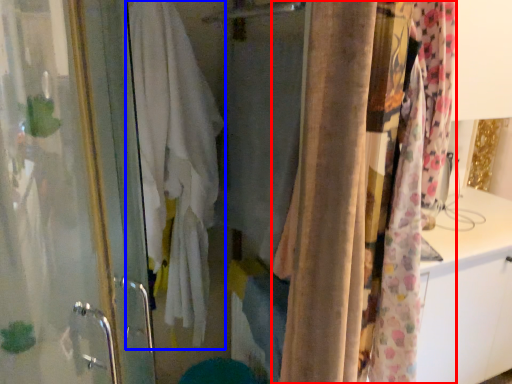
Question: Which object is closer to the camera taking this photo, curtain (highlighted by a red box) or bath towel (highlighted by a blue box)?

Choices:
 (A) curtain
 (B) bath towel

Answer: (A)